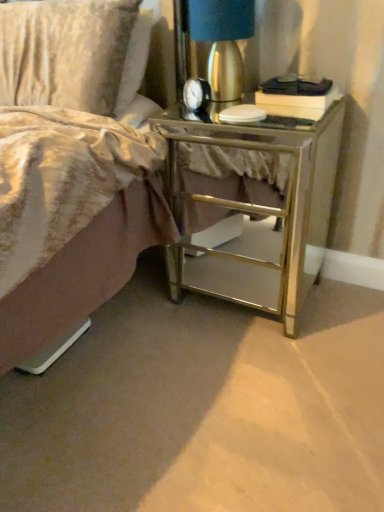
This screenshot has height=512, width=384. In order to click on free spot to the left of mirrored glass nightstand at lower right in this screenshot , I will do `click(142, 328)`.